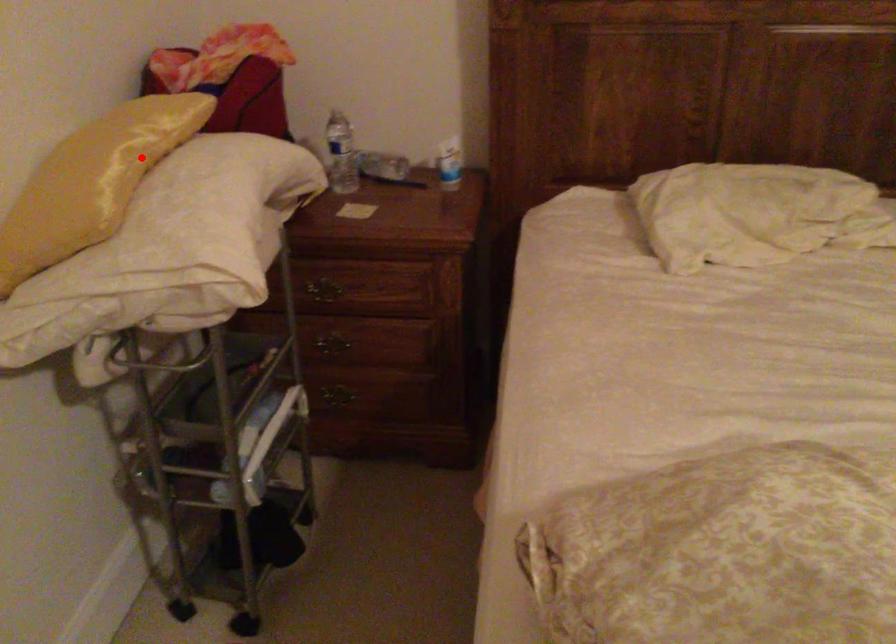
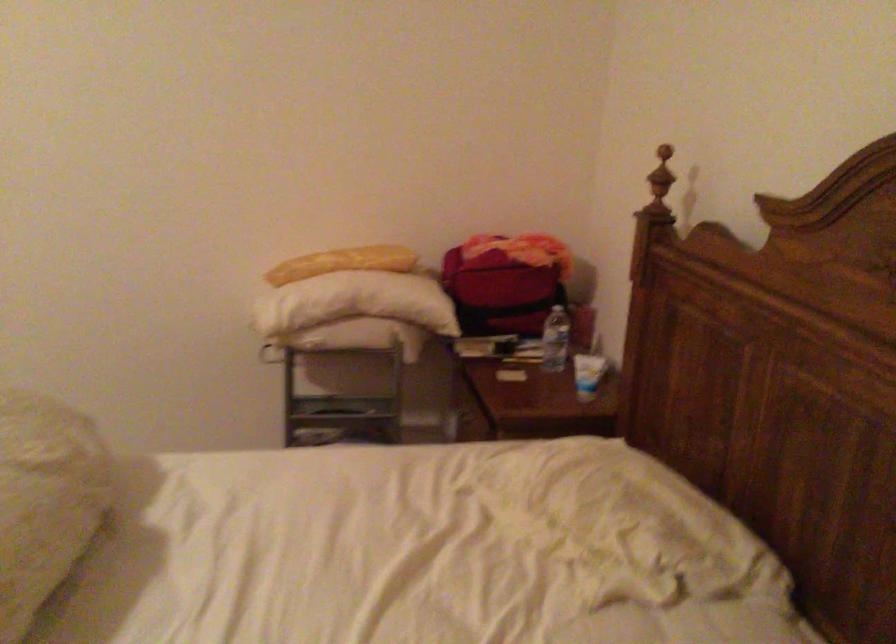
Question: I am providing you with two images of the same scene from different viewpoints. Image1 has a red point marked. In image2, the corresponding 3D location appears at what relative position? Reply with the corresponding letter.

Choices:
 (A) Closer
 (B) Farther

Answer: (B)